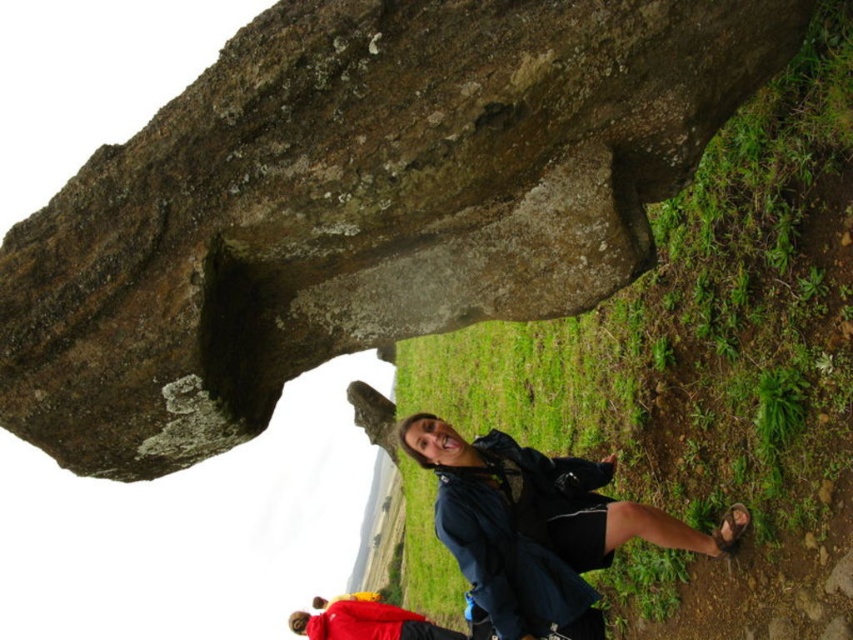
You are planning to take a photo of the rough stone boulder at upper center and the matte blue jacket at lower right. Which object should you focus on first if you want to capture both in a single frame without moving the camera?

The rough stone boulder at upper center should be focused on first because it is larger in size than the matte blue jacket at lower right, so it requires more attention to detail to ensure it fits properly in the frame.

You are a hiker who wants to take a photo of the rough stone boulder at upper center and the matte blue jacket at lower right. Which object should you focus on first if you want to capture both in the same frame without moving the camera?

The rough stone boulder at upper center is above the matte blue jacket at lower right, so you should focus on the rough stone boulder at upper center first to ensure both are in the frame.

You are standing at the base of the large stone structure and see two points marked in the scene. Which point, point (677,104) or point (671,516), is closer to you?

Point (677,104) is closer to you because it is in front of point (671,516).